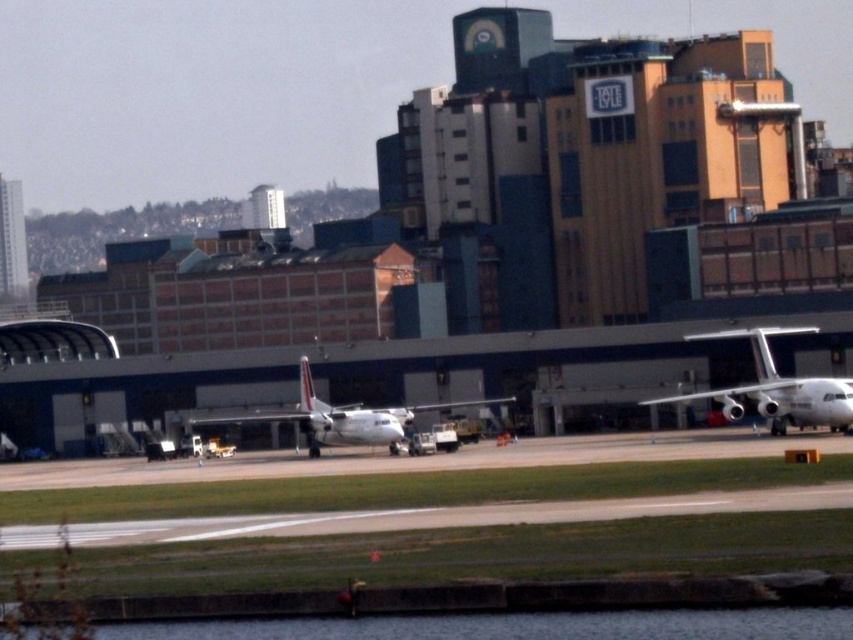
Question: Among these objects, which one is farthest from the camera?

Choices:
 (A) smooth asphalt runway at center
 (B) white glossy airplane at right

Answer: (B)

Question: Considering the relative positions of smooth asphalt runway at center and white glossy airplane at right in the image provided, where is smooth asphalt runway at center located with respect to white glossy airplane at right?

Choices:
 (A) left
 (B) right

Answer: (A)

Question: Does white glossy airplane at right have a lesser width compared to white matte airplane at center?

Choices:
 (A) yes
 (B) no

Answer: (A)

Question: Estimate the real-world distances between objects in this image. Which object is farther from the white glossy airplane at right?

Choices:
 (A) smooth asphalt runway at center
 (B) white matte airplane at center

Answer: (A)

Question: Which object is positioned farthest from the smooth asphalt runway at center?

Choices:
 (A) white glossy airplane at right
 (B) white matte airplane at center

Answer: (B)

Question: Is white glossy airplane at right positioned in front of white matte airplane at center?

Choices:
 (A) no
 (B) yes

Answer: (B)